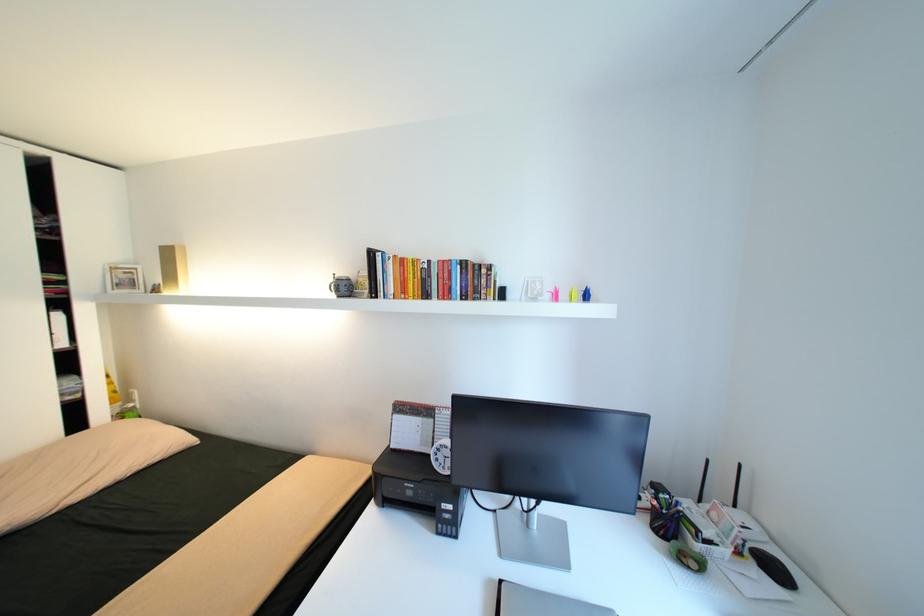
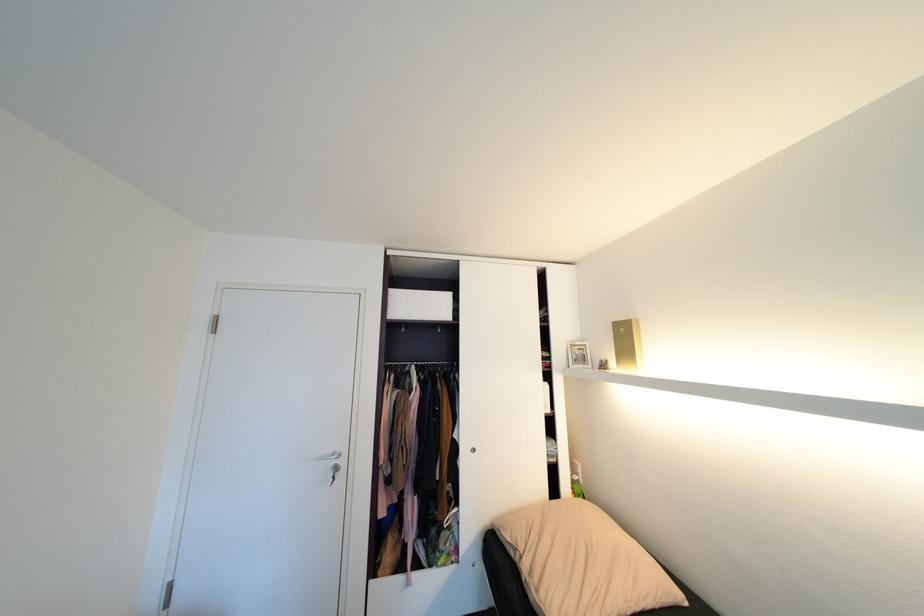
Where in the second image is the point corresponding to pixel 131 273 from the first image?

(587, 350)